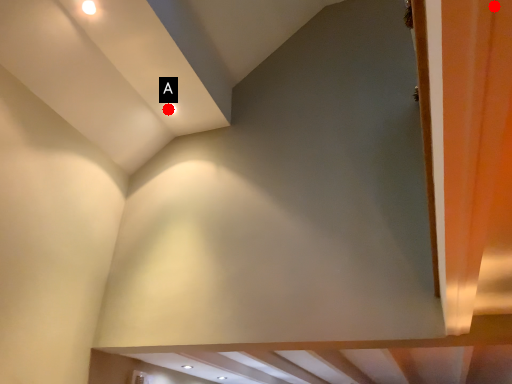
Question: Two points are circled on the image, labeled by A and B beside each circle. Among these points, which one is nearest to the camera?

Choices:
 (A) A is closer
 (B) B is closer

Answer: (B)